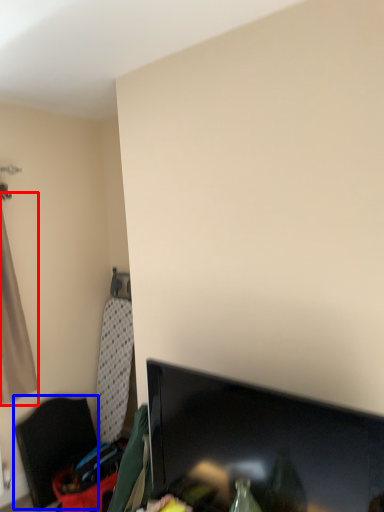
Question: Which object appears closest to the camera in this image, curtain (highlighted by a red box) or furniture (highlighted by a blue box)?

Choices:
 (A) curtain
 (B) furniture

Answer: (A)